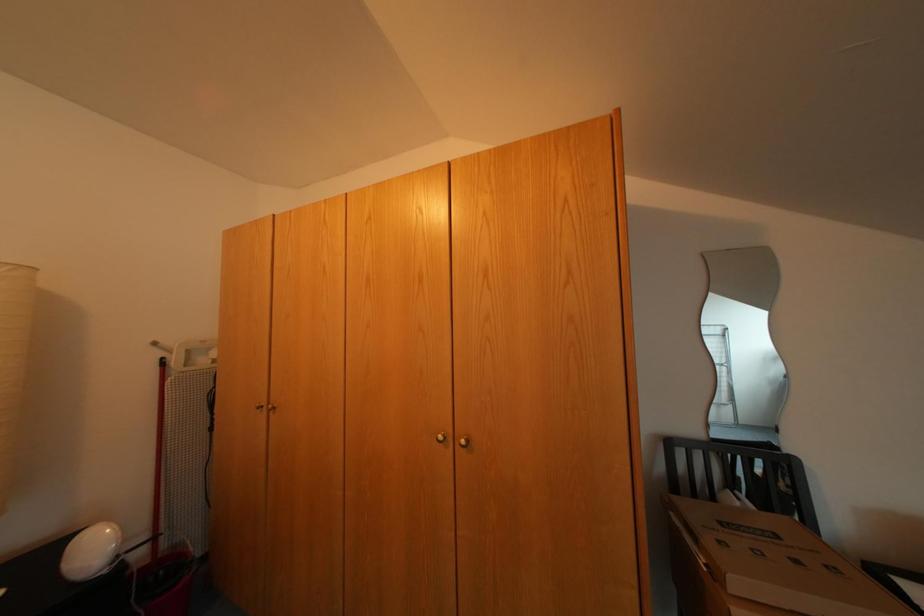
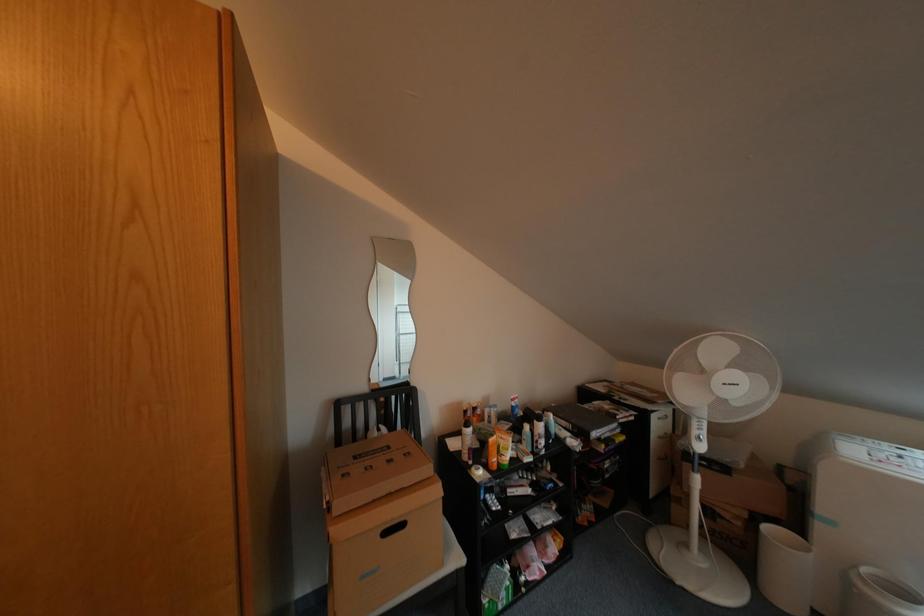
Question: Based on the continuous images, in which direction is the camera rotating? Reply with the corresponding letter.

Choices:
 (A) Left
 (B) Right
 (C) Up
 (D) Down

Answer: (B)